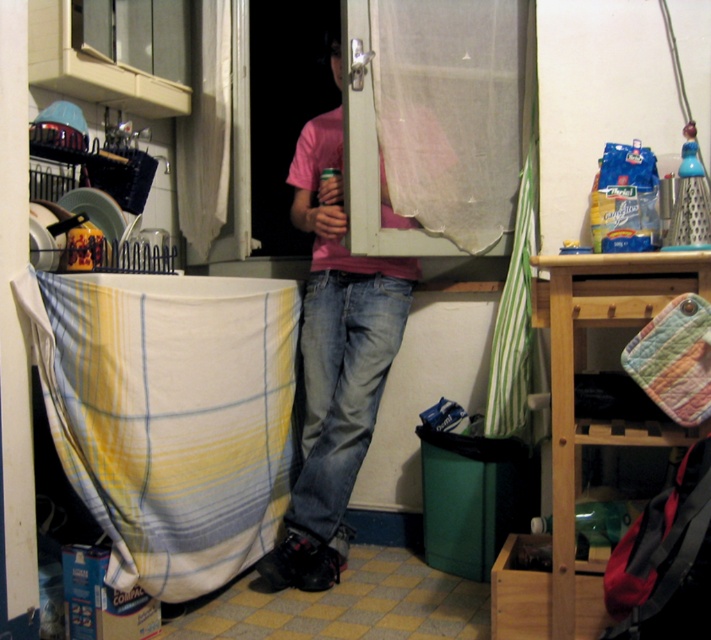
Does yellow/white plaid fabric at lower left appear over pink cotton shirt at center?

Actually, yellow/white plaid fabric at lower left is below pink cotton shirt at center.

Which of these two, yellow/white plaid fabric at lower left or pink cotton shirt at center, stands shorter?

yellow/white plaid fabric at lower left

Measure the distance between point (80, 316) and camera.

The distance of point (80, 316) from camera is 5.42 feet.

Where is `yellow/white plaid fabric at lower left`? The image size is (711, 640). yellow/white plaid fabric at lower left is located at coordinates (171, 416).

Does point (26, 282) come in front of point (267, 228)?

Yes, it is.

Does point (105, 316) lie behind point (272, 104)?

That is False.

Identify the location of yellow/white plaid fabric at lower left. The image size is (711, 640). (171, 416).

Is pink cotton shirt at center further to the viewer compared to matte plastic screen door at center?

No.

Does point (288, 506) come in front of point (289, 144)?

That is True.

Identify the location of pink cotton shirt at center. The height and width of the screenshot is (640, 711). (333, 362).